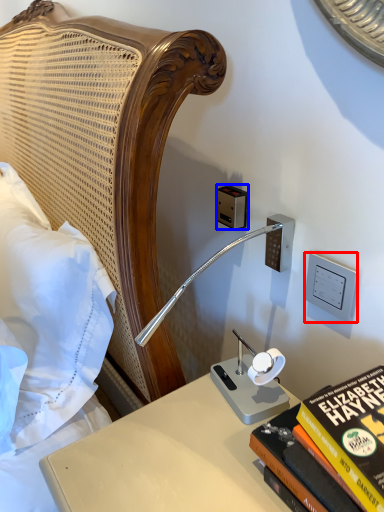
Question: Which object appears farthest to the camera in this image, electric outlet (highlighted by a red box) or electric outlet (highlighted by a blue box)?

Choices:
 (A) electric outlet
 (B) electric outlet

Answer: (B)